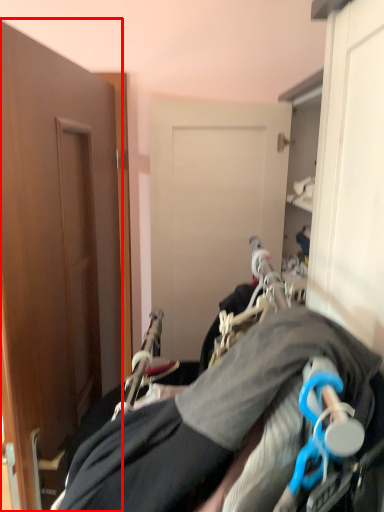
Question: Considering the relative positions of door (annotated by the red box) and couple in the image provided, where is door (annotated by the red box) located with respect to the staircase?

Choices:
 (A) right
 (B) left

Answer: (B)